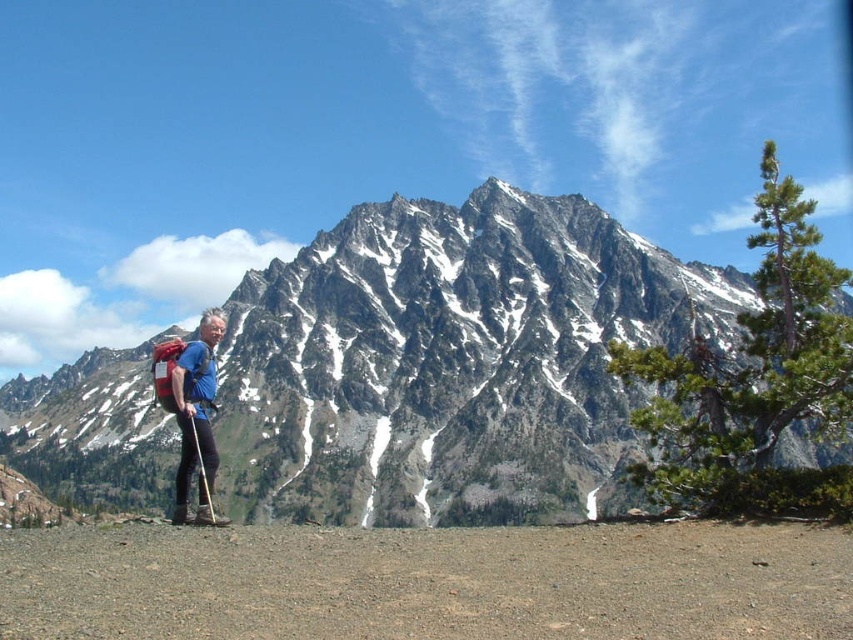
Question: Estimate the real-world distances between objects in this image. Which object is closer to the gray rocky mountain at center?

Choices:
 (A) blue fabric backpack at lower left
 (B) green needle-like tree at upper right
 (C) wooden ski pole at center

Answer: (B)

Question: Is green needle-like tree at upper right smaller than blue fabric backpack at lower left?

Choices:
 (A) no
 (B) yes

Answer: (A)

Question: Is gray rocky mountain at center to the left of blue fabric backpack at lower left from the viewer's perspective?

Choices:
 (A) yes
 (B) no

Answer: (B)

Question: Which point appears closest to the camera in this image?

Choices:
 (A) click(x=207, y=333)
 (B) click(x=187, y=417)
 (C) click(x=697, y=435)
 (D) click(x=740, y=273)

Answer: (C)

Question: Which of the following is the closest to the observer?

Choices:
 (A) blue fabric backpack at lower left
 (B) wooden ski pole at center
 (C) green needle-like tree at upper right
 (D) gray rocky mountain at center

Answer: (C)

Question: Can you confirm if green needle-like tree at upper right is positioned to the right of wooden ski pole at center?

Choices:
 (A) no
 (B) yes

Answer: (B)